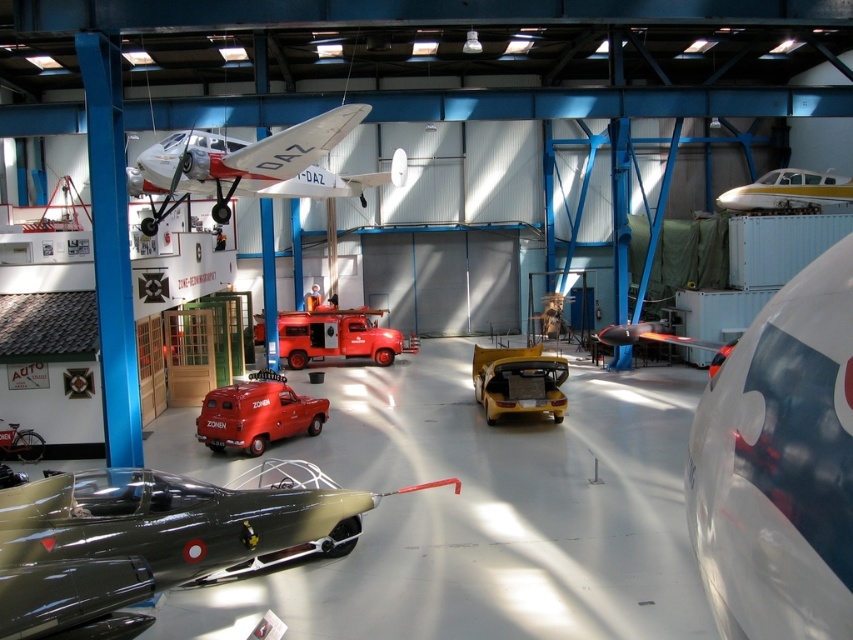
You are standing in the hangar and want to take a photo of both the matte red van at center and the yellow matte car at center. Which one should you focus on first to ensure both are in clear view?

You should focus on the matte red van at center first since it is closer to you than the yellow matte car at center, ensuring both are in clear view when focusing on the closer object first.